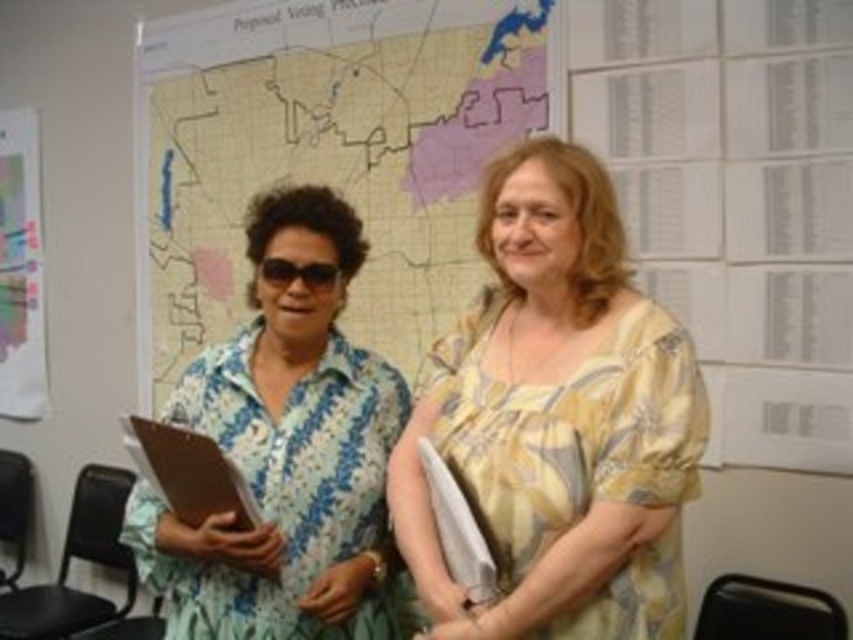
Which is more to the right, floral fabric blouse at left or brown wood clipboard at left?

From the viewer's perspective, floral fabric blouse at left appears more on the right side.

Does floral fabric blouse at left come behind brown wood clipboard at left?

Yes.

Who is more forward, (374,632) or (229,497)?

Point (229,497)

I want to click on floral fabric blouse at left, so click(x=286, y=456).

Between map at center and black plastic sunglasses at left, which one has less height?

black plastic sunglasses at left

Who is higher up, map at center or black plastic sunglasses at left?

map at center is higher up.

Is point (212, 227) positioned behind point (271, 266)?

That is True.

Locate an element on the screen. map at center is located at coordinates (326, 150).

Can you confirm if map at center is taller than yellow floral blouse at center?

Indeed, map at center has a greater height compared to yellow floral blouse at center.

Does map at center have a lesser height compared to yellow floral blouse at center?

No.

Who is more forward, (331,67) or (572,241)?

Point (572,241) is more forward.

Locate an element on the screen. The image size is (853, 640). map at center is located at coordinates (326, 150).